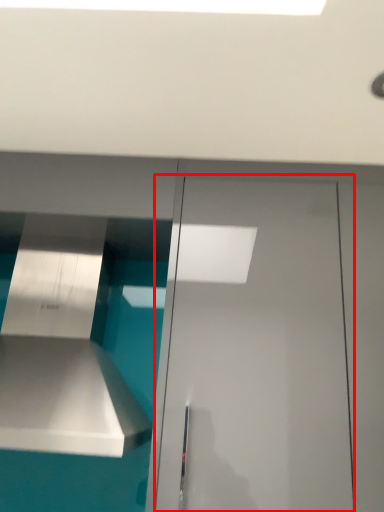
Question: From the image's perspective, where is door (annotated by the red box) located relative to vent?

Choices:
 (A) above
 (B) below

Answer: (B)